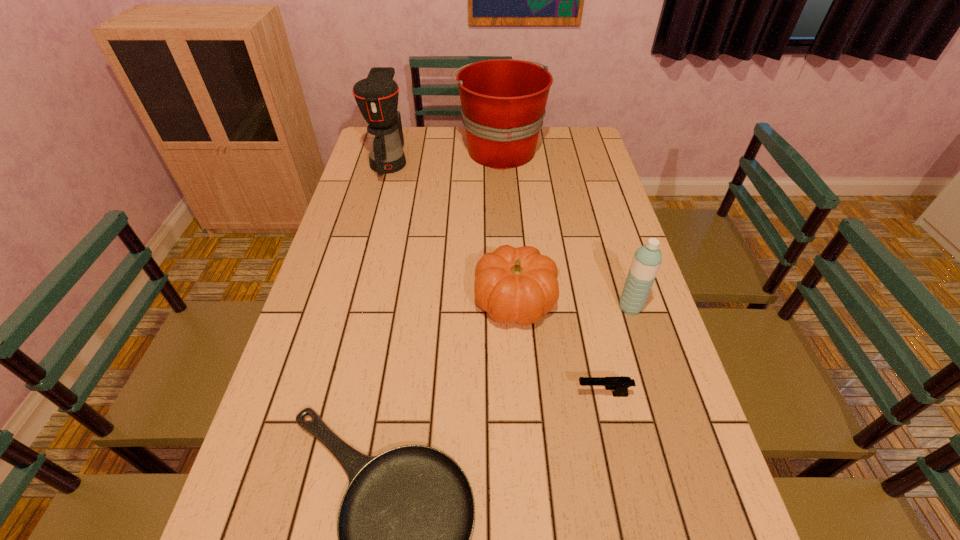
This screenshot has width=960, height=540. I want to click on vacant area at the far edge, so click(x=420, y=136).

Locate an element on the screen. free space at the left edge of the desktop is located at coordinates (340, 273).

This screenshot has height=540, width=960. Find the location of `vacant space at the right edge`. vacant space at the right edge is located at coordinates (624, 338).

Locate an element on the screen. This screenshot has height=540, width=960. free spot between the pistol and the pumpkin is located at coordinates (559, 348).

Identify the location of vacant area that lies between the second nearest object and the pumpkin. (559, 348).

Find the location of a particular element. This screenshot has width=960, height=540. free space between the water bottle and the fifth tallest object is located at coordinates (616, 351).

At what (x,y) coordinates should I click in order to perform the action: click on free space between the coffee maker and the bucket. Please return your answer as a coordinate pair (x, y). This screenshot has height=540, width=960. Looking at the image, I should click on (444, 156).

Identify the location of vacant point located between the pumpkin and the second nearest object. (559, 348).

The image size is (960, 540). I want to click on vacant area between the fourth tallest object and the coffee maker, so click(452, 231).

I want to click on free space between the pistol and the fourth shortest object, so click(x=616, y=351).